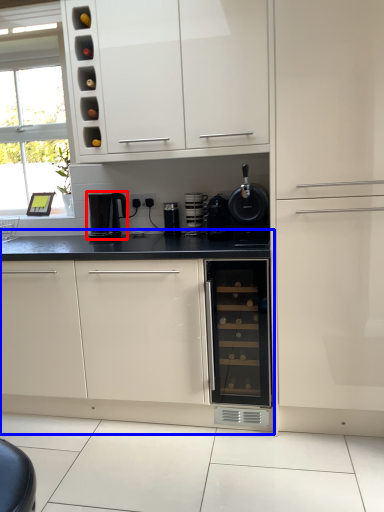
Question: Which point is closer to the camera, kitchen appliance (highlighted by a red box) or cabinetry (highlighted by a blue box)?

Choices:
 (A) kitchen appliance
 (B) cabinetry

Answer: (B)